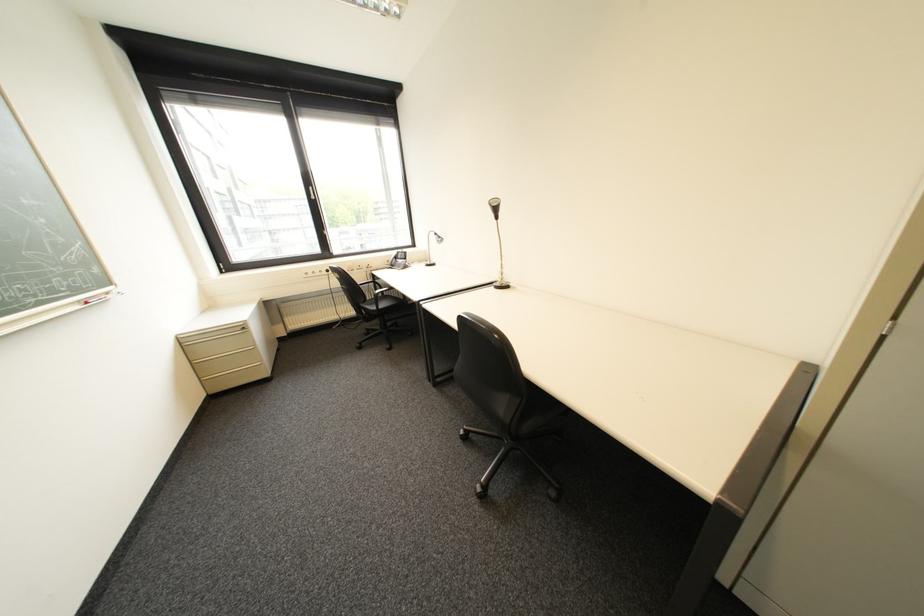
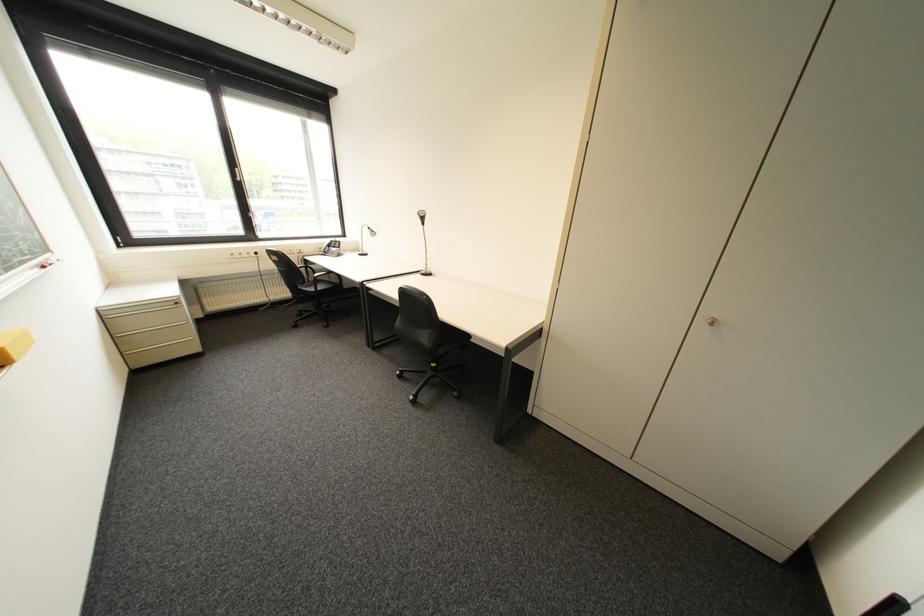
Where in the second image is the point corresponding to (x=403, y=254) from the first image?

(335, 244)